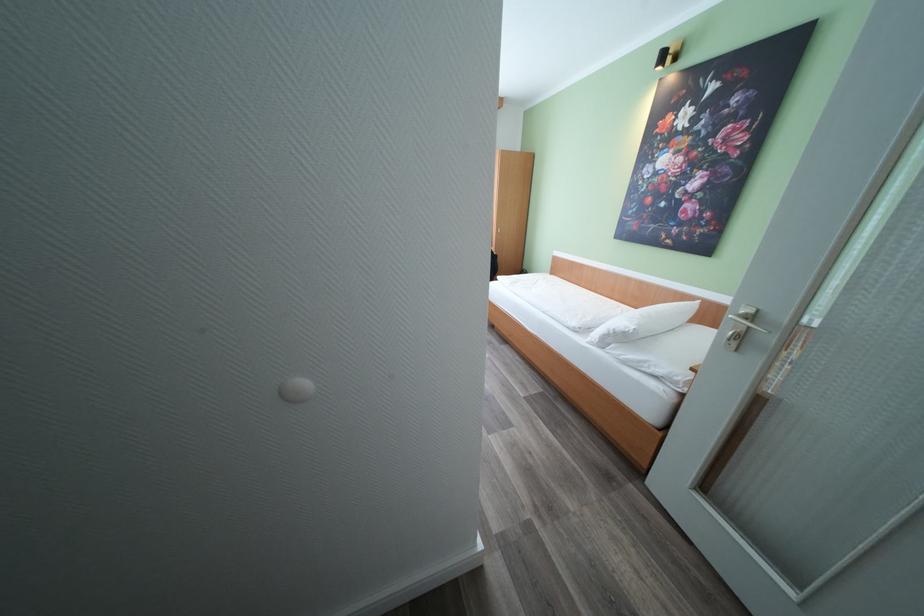
Describe the element at coordinates (748, 318) in the screenshot. The height and width of the screenshot is (616, 924). I see `the silver door handle` at that location.